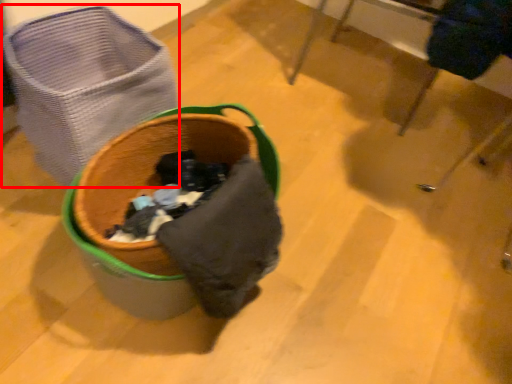
Question: From the image's perspective, where is laundry basket (annotated by the red box) located in relation to furniture in the image?

Choices:
 (A) below
 (B) above

Answer: (A)